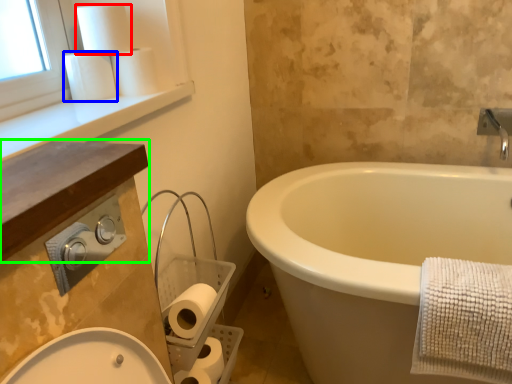
Question: Which is nearer to the toilet paper (highlighted by a red box)? toilet paper (highlighted by a blue box) or counter top (highlighted by a green box).

Choices:
 (A) toilet paper
 (B) counter top

Answer: (A)